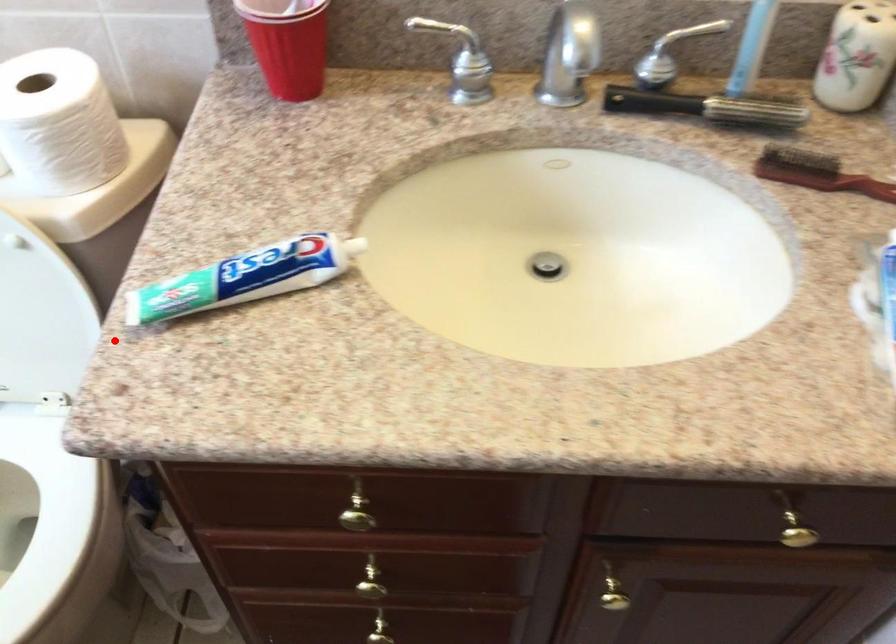
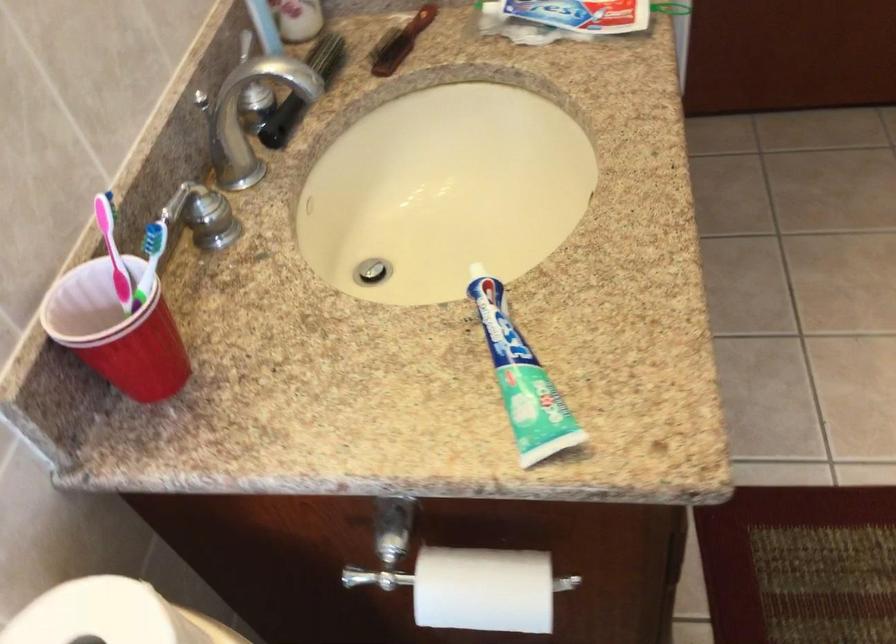
In the second image, find the point that corresponds to the highlighted location in the first image.

(483, 589)